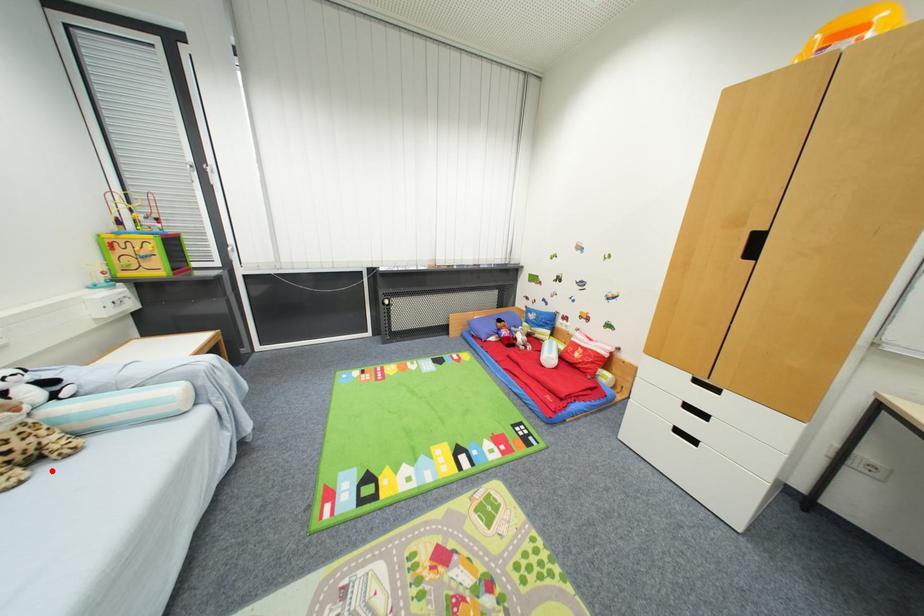
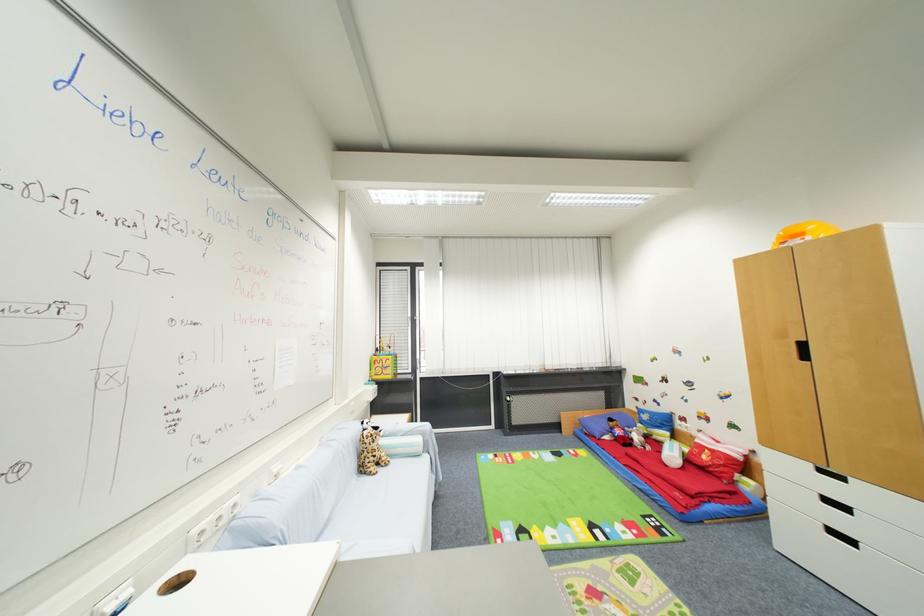
Where in the second image is the point corresponding to the highlighted location from the first image?

(385, 472)